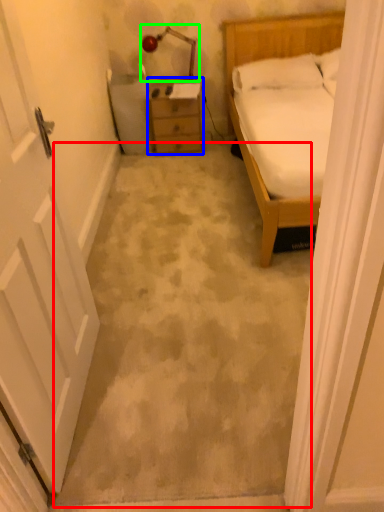
Question: Which object is the closest to the concrete (highlighted by a red box)? Choose among these: chest of drawers (highlighted by a blue box) or lamp (highlighted by a green box).

Choices:
 (A) chest of drawers
 (B) lamp

Answer: (A)